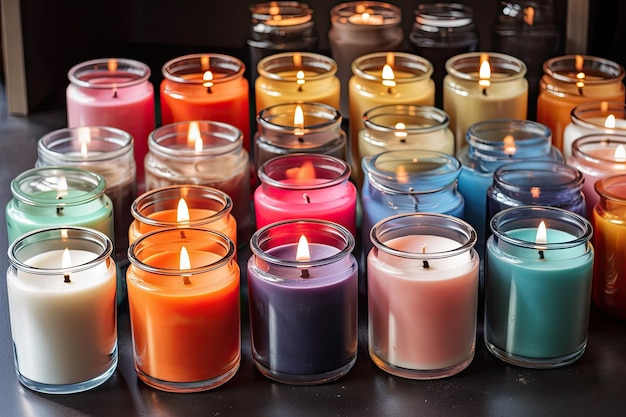
Where is `rightmost column of candles`? This screenshot has width=626, height=417. rightmost column of candles is located at coordinates click(x=570, y=79), click(x=597, y=113), click(x=603, y=154), click(x=618, y=208).